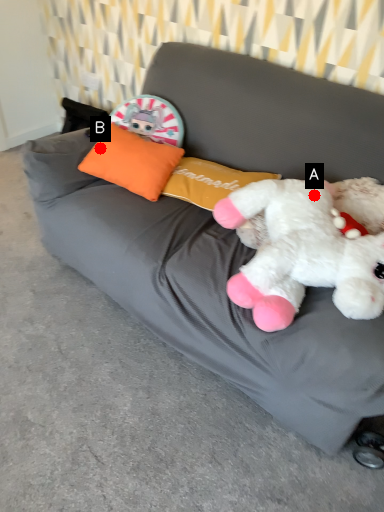
Question: Two points are circled on the image, labeled by A and B beside each circle. Which of the following is the closest to the observer?

Choices:
 (A) A is closer
 (B) B is closer

Answer: (A)